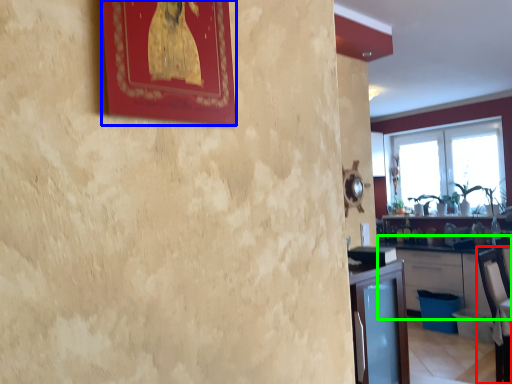
Question: Based on their relative distances, which object is nearer to armchair (highlighted by a red box)? Choose from picture frame (highlighted by a blue box) and cabinetry (highlighted by a green box).

Choices:
 (A) picture frame
 (B) cabinetry

Answer: (B)